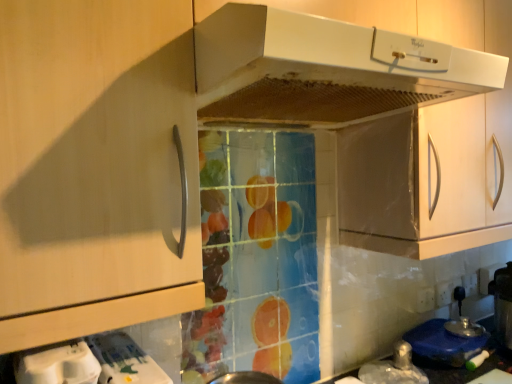
Identify the location of white glossy water at lower left, the second appliance from the bottom. Image resolution: width=512 pixels, height=384 pixels. (124, 360).

Measure the distance between white plastic container at lower left, marked as the 3th appliance in a bottom-to-top arrangement, and camera.

white plastic container at lower left, marked as the 3th appliance in a bottom-to-top arrangement, and camera are 22.69 inches apart.

This screenshot has height=384, width=512. What do you see at coordinates (443, 344) in the screenshot? I see `blue plastic lid at lower right, arranged as the first appliance when viewed from the back` at bounding box center [443, 344].

You are a GUI agent. You are given a task and a screenshot of the screen. Output one action in this format:
    pyautogui.click(x=<x>, y=<y>)
    Task: Click on the white matte range hood at upper center
    The height and width of the screenshot is (384, 512).
    Given the screenshot: What is the action you would take?
    click(x=316, y=70)

Is white glossy water at lower left, the 2th appliance from the front, to the left or to the right of white matte range hood at upper center in the image?

Based on their positions, white glossy water at lower left, the 2th appliance from the front, is located to the left of white matte range hood at upper center.

From a real-world perspective, is white glossy water at lower left, which ranks as the 2th appliance in right-to-left order, physically above white matte range hood at upper center?

No, from a real-world perspective, white glossy water at lower left, which ranks as the 2th appliance in right-to-left order, is not above white matte range hood at upper center.

Which object is more forward, white glossy water at lower left, placed as the second appliance when sorted from top to bottom, or white matte range hood at upper center?

Positioned in front is white matte range hood at upper center.

Is white glossy water at lower left, the second appliance from the bottom, in front of blue plastic lid at lower right, marked as the 1th appliance in a right-to-left arrangement?

Yes, it is.

Considering the positions of objects white glossy water at lower left, the second appliance from the bottom, and blue plastic lid at lower right, marked as the 3th appliance in a front-to-back arrangement, in the image provided, who is more to the left, white glossy water at lower left, the second appliance from the bottom, or blue plastic lid at lower right, marked as the 3th appliance in a front-to-back arrangement,?

Positioned to the left is white glossy water at lower left, the second appliance from the bottom.

Is white glossy water at lower left, which is counted as the second appliance, starting from the back, shorter than blue plastic lid at lower right, the 3th appliance in the top-to-bottom sequence?

Incorrect, the height of white glossy water at lower left, which is counted as the second appliance, starting from the back, does not fall short of that of blue plastic lid at lower right, the 3th appliance in the top-to-bottom sequence.

From the picture: Can you confirm if white plastic container at lower left, the third appliance viewed from the right, is wider than blue plastic lid at lower right, marked as the 3th appliance in a front-to-back arrangement?

Yes.

Is white plastic container at lower left, the third appliance viewed from the right, oriented away from blue plastic lid at lower right, arranged as the first appliance when viewed from the back?

white plastic container at lower left, the third appliance viewed from the right, is not turned away from blue plastic lid at lower right, arranged as the first appliance when viewed from the back.

You are a GUI agent. You are given a task and a screenshot of the screen. Output one action in this format:
    pyautogui.click(x=<x>, y=<y>)
    Task: Click on the appliance that is the 2nd object located below the white plastic container at lower left, positioned as the first appliance in left-to-right order (from the image's perspective)
    The image size is (512, 384).
    Given the screenshot: What is the action you would take?
    pyautogui.click(x=443, y=344)

From a real-world perspective, which is physically below, white plastic container at lower left, marked as the third appliance in a back-to-front arrangement, or blue plastic lid at lower right, the 3th appliance in the top-to-bottom sequence?

blue plastic lid at lower right, the 3th appliance in the top-to-bottom sequence, is physically lower.

Considering the relative sizes of white matte range hood at upper center and blue plastic lid at lower right, marked as the third appliance in a left-to-right arrangement, in the image provided, is white matte range hood at upper center shorter than blue plastic lid at lower right, marked as the third appliance in a left-to-right arrangement,?

No.

The width and height of the screenshot is (512, 384). I want to click on appliance lying on the right of white matte range hood at upper center, so click(443, 344).

From a real-world perspective, is white matte range hood at upper center on top of blue plastic lid at lower right, marked as the 3th appliance in a front-to-back arrangement?

Correct, in the physical world, white matte range hood at upper center is higher than blue plastic lid at lower right, marked as the 3th appliance in a front-to-back arrangement.

From the image's perspective, between white matte range hood at upper center and blue plastic lid at lower right, marked as the 1th appliance in a right-to-left arrangement, which one is located above?

white matte range hood at upper center appears higher in the image.

Considering the relative positions of white matte range hood at upper center and white plastic container at lower left, the third appliance viewed from the right, in the image provided, is white matte range hood at upper center to the right of white plastic container at lower left, the third appliance viewed from the right, from the viewer's perspective?

Yes.

Between white matte range hood at upper center and white plastic container at lower left, marked as the first appliance in a front-to-back arrangement, which one has larger width?

Result: white matte range hood at upper center.

From a real-world perspective, is white matte range hood at upper center positioned above or below white plastic container at lower left, positioned as the first appliance in top-to-bottom order?

white matte range hood at upper center is above white plastic container at lower left, positioned as the first appliance in top-to-bottom order.

Is point (341, 105) farther from viewer compared to point (64, 343)?

That is True.

Considering the relative sizes of white glossy water at lower left, the 2th appliance from the front, and white plastic container at lower left, marked as the third appliance in a back-to-front arrangement, in the image provided, is white glossy water at lower left, the 2th appliance from the front, thinner than white plastic container at lower left, marked as the third appliance in a back-to-front arrangement,?

Incorrect, the width of white glossy water at lower left, the 2th appliance from the front, is not less than that of white plastic container at lower left, marked as the third appliance in a back-to-front arrangement.

Is white glossy water at lower left, which ranks as the 2th appliance in right-to-left order, far from white plastic container at lower left, positioned as the first appliance in left-to-right order?

Actually, white glossy water at lower left, which ranks as the 2th appliance in right-to-left order, and white plastic container at lower left, positioned as the first appliance in left-to-right order, are a little close together.

Is white glossy water at lower left, placed as the second appliance when sorted from top to bottom, looking in the opposite direction of white plastic container at lower left, positioned as the first appliance in left-to-right order?

No, white plastic container at lower left, positioned as the first appliance in left-to-right order, is not at the back of white glossy water at lower left, placed as the second appliance when sorted from top to bottom.

Considering the sizes of blue plastic lid at lower right, which appears as the 1th appliance when ordered from the bottom, and white matte range hood at upper center in the image, is blue plastic lid at lower right, which appears as the 1th appliance when ordered from the bottom, wider or thinner than white matte range hood at upper center?

In the image, blue plastic lid at lower right, which appears as the 1th appliance when ordered from the bottom, appears to be more narrow than white matte range hood at upper center.

Considering the relative positions of blue plastic lid at lower right, marked as the 3th appliance in a front-to-back arrangement, and white matte range hood at upper center in the image provided, is blue plastic lid at lower right, marked as the 3th appliance in a front-to-back arrangement, behind white matte range hood at upper center?

Yes, it is.

Looking at this image, which is more to the right, blue plastic lid at lower right, marked as the third appliance in a left-to-right arrangement, or white matte range hood at upper center?

blue plastic lid at lower right, marked as the third appliance in a left-to-right arrangement, is more to the right.

Can you confirm if blue plastic lid at lower right, marked as the third appliance in a left-to-right arrangement, is shorter than white matte range hood at upper center?

Correct, blue plastic lid at lower right, marked as the third appliance in a left-to-right arrangement, is not as tall as white matte range hood at upper center.

From the image's perspective, which appliance is the 2nd one below the white matte range hood at upper center? Please provide its 2D coordinates.

[(124, 360)]

This screenshot has width=512, height=384. Find the location of `appliance below the white glossy water at lower left, the 2th appliance from the front (from a real-world perspective)`. appliance below the white glossy water at lower left, the 2th appliance from the front (from a real-world perspective) is located at coordinates (443, 344).

Estimate the real-world distances between objects in this image. Which object is further from white glossy water at lower left, placed as the second appliance when sorted from top to bottom, white matte range hood at upper center or blue plastic lid at lower right, marked as the 3th appliance in a front-to-back arrangement?

Based on the image, blue plastic lid at lower right, marked as the 3th appliance in a front-to-back arrangement, appears to be further to white glossy water at lower left, placed as the second appliance when sorted from top to bottom.

Estimate the real-world distances between objects in this image. Which object is further from white matte range hood at upper center, white glossy water at lower left, the 2th appliance from the front, or white plastic container at lower left, the third appliance viewed from the right?

white plastic container at lower left, the third appliance viewed from the right, is further to white matte range hood at upper center.

Based on their spatial positions, is white glossy water at lower left, the second appliance from the bottom, or blue plastic lid at lower right, which appears as the 1th appliance when ordered from the bottom, closer to white plastic container at lower left, marked as the first appliance in a front-to-back arrangement?

white glossy water at lower left, the second appliance from the bottom, is closer to white plastic container at lower left, marked as the first appliance in a front-to-back arrangement.

When comparing their distances from white matte range hood at upper center, does white glossy water at lower left, the 2th appliance from the front, or blue plastic lid at lower right, the 3th appliance in the top-to-bottom sequence, seem closer?

white glossy water at lower left, the 2th appliance from the front, is closer to white matte range hood at upper center.

Based on their spatial positions, is white matte range hood at upper center or white glossy water at lower left, placed as the second appliance when sorted from top to bottom, closer to white plastic container at lower left, positioned as the first appliance in top-to-bottom order?

white glossy water at lower left, placed as the second appliance when sorted from top to bottom, is closer to white plastic container at lower left, positioned as the first appliance in top-to-bottom order.

Based on the photo, when comparing their distances from white matte range hood at upper center, does blue plastic lid at lower right, marked as the third appliance in a left-to-right arrangement, or white plastic container at lower left, positioned as the first appliance in top-to-bottom order, seem further?

blue plastic lid at lower right, marked as the third appliance in a left-to-right arrangement, is further to white matte range hood at upper center.

Which object lies nearer to the anchor point white matte range hood at upper center, blue plastic lid at lower right, the 3th appliance in the top-to-bottom sequence, or white glossy water at lower left, which is counted as the second appliance, starting from the back?

white glossy water at lower left, which is counted as the second appliance, starting from the back, lies closer to white matte range hood at upper center than the other object.

Based on their spatial positions, is white plastic container at lower left, positioned as the first appliance in top-to-bottom order, or white glossy water at lower left, which ranks as the 2th appliance in right-to-left order, further from white matte range hood at upper center?

Based on the image, white plastic container at lower left, positioned as the first appliance in top-to-bottom order, appears to be further to white matte range hood at upper center.

Identify the location of home appliance between white plastic container at lower left, the third appliance viewed from the right, and blue plastic lid at lower right, marked as the 3th appliance in a front-to-back arrangement, from left to right. This screenshot has width=512, height=384. (316, 70).

This screenshot has width=512, height=384. I want to click on home appliance situated between white glossy water at lower left, which is counted as the second appliance, starting from the back, and blue plastic lid at lower right, arranged as the first appliance when viewed from the back, from left to right, so click(316, 70).

This screenshot has width=512, height=384. Identify the location of appliance between white plastic container at lower left, marked as the first appliance in a front-to-back arrangement, and blue plastic lid at lower right, marked as the 1th appliance in a right-to-left arrangement, in the horizontal direction. (124, 360).

At what (x,y) coordinates should I click in order to perform the action: click on appliance that lies between white matte range hood at upper center and white glossy water at lower left, placed as the second appliance when sorted from left to right, from top to bottom. Please return your answer as a coordinate pair (x, y). Image resolution: width=512 pixels, height=384 pixels. Looking at the image, I should click on (57, 364).